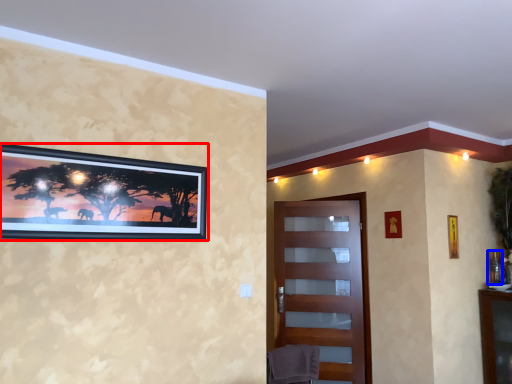
Question: Which object is closer to the camera taking this photo, picture frame (highlighted by a red box) or picture frame (highlighted by a blue box)?

Choices:
 (A) picture frame
 (B) picture frame

Answer: (A)